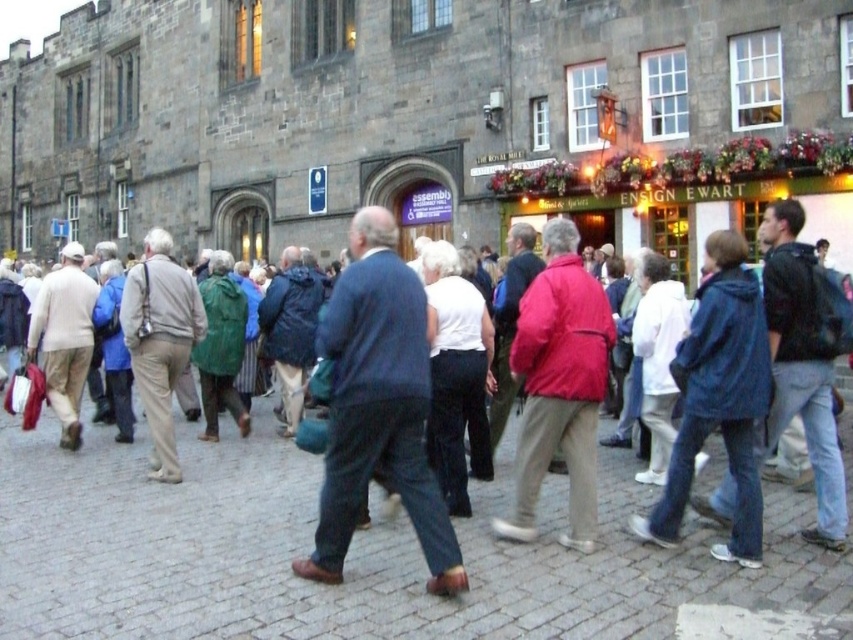
Who is positioned more to the right, brick pavement at center or blue denim jacket at center?

From the viewer's perspective, brick pavement at center appears more on the right side.

Is point (670, 608) less distant than point (300, 465)?

That is True.

Does point (511, 451) lie in front of point (476, 493)?

No, (511, 451) is behind (476, 493).

Where is `brick pavement at center`? The height and width of the screenshot is (640, 853). brick pavement at center is located at coordinates (364, 557).

Which is more to the left, brick pavement at center or red matte jacket at center?

brick pavement at center is more to the left.

Between point (432, 627) and point (569, 326), which one is positioned behind?

Point (569, 326)

In order to click on brick pavement at center in this screenshot , I will do `click(364, 557)`.

Who is more forward, (38,477) or (347,426)?

Point (347,426) is in front.

Is point (123, 502) closer to camera compared to point (340, 534)?

No, (123, 502) is further to viewer.

The height and width of the screenshot is (640, 853). I want to click on brick pavement at center, so click(364, 557).